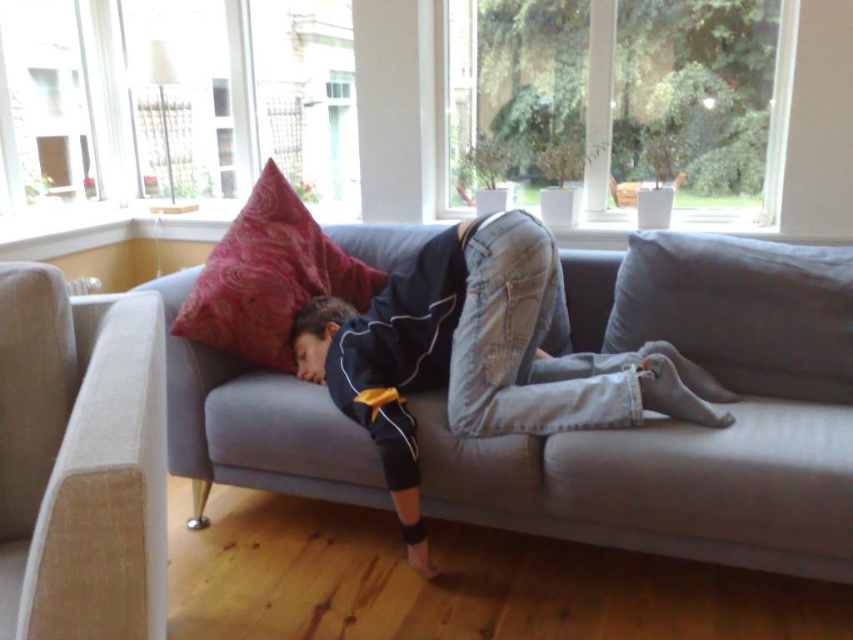
Does point (57, 496) come closer to viewer compared to point (180, 317)?

Yes, it is in front of point (180, 317).

Which is behind, point (65, 376) or point (289, 225)?

Positioned behind is point (289, 225).

You are a GUI agent. You are given a task and a screenshot of the screen. Output one action in this format:
    pyautogui.click(x=<x>, y=<y>)
    Task: Click on the beige fabric couch at lower left
    
    Given the screenshot: What is the action you would take?
    pyautogui.click(x=80, y=460)

Is matte gray couch at center bigger than velvet red pillow at upper left?

Indeed, matte gray couch at center has a larger size compared to velvet red pillow at upper left.

Who is positioned more to the right, matte gray couch at center or velvet red pillow at upper left?

Positioned to the right is matte gray couch at center.

Is point (770, 365) behind point (263, 266)?

No.

Image resolution: width=853 pixels, height=640 pixels. What are the coordinates of `matte gray couch at center` in the screenshot? It's located at (683, 424).

Does matte gray couch at center have a larger size compared to beige fabric couch at lower left?

Correct, matte gray couch at center is larger in size than beige fabric couch at lower left.

Who is more distant from viewer, [369,474] or [125,529]?

Point [369,474]

Where is `matte gray couch at center`? The height and width of the screenshot is (640, 853). matte gray couch at center is located at coordinates (683, 424).

Where is `matte gray couch at center`? The image size is (853, 640). matte gray couch at center is located at coordinates (683, 424).